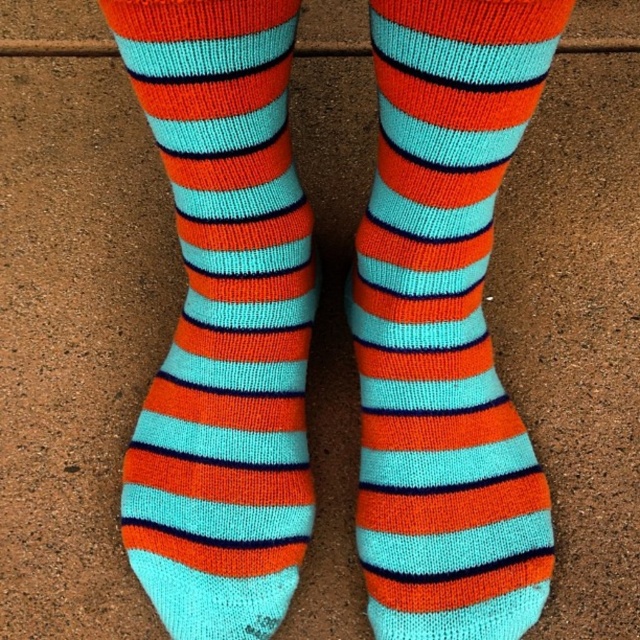
You are organizing a sock drawer and notice two pairs of socks at the center of the drawer. One is labeled as the knitted cotton sock at center and the other as the knit socks at center. Which pair takes up less space in the drawer?

The knitted cotton sock at center is smaller than the knit socks at center, so it takes up less space in the drawer.

You are a tailor measuring two items for a customer. You have a knitted cotton sock at center and a knit socks at center. The customer wants to know if they can fit both items into a gift box that is 8 inches wide. Can you confirm if they will fit side by side?

The knitted cotton sock at center and knit socks at center are 7.54 inches apart, so they can fit side by side in an 8 inch wide gift box since the total width required is less than 8 inches.

You are taking a photo of the socks and want to focus on the point closer to the camera. Which point should you choose between point (429, 609) and point (284, 4)?

Point (284, 4) is closer to the camera than point (429, 609), so you should focus on point (284, 4).